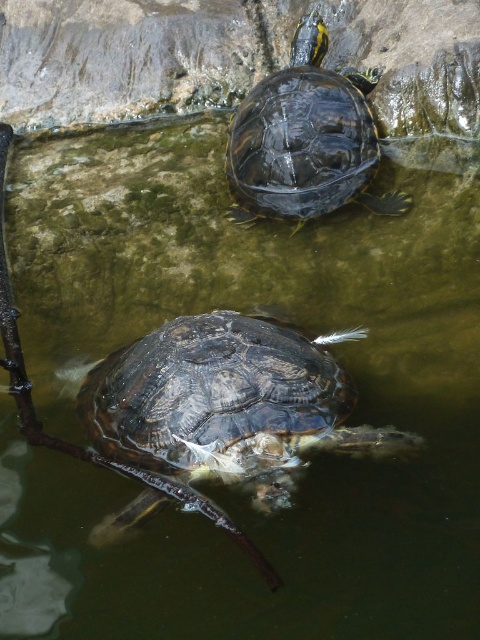
You are a wildlife photographer aiming to capture a closeup shot of both the shiny dark turtle at center and the shiny dark turtle at upper center. Given that your camera lens has a maximum focus range of 80 centimeters, can you photograph both turtles without moving your position?

The shiny dark turtle at center is 82.37 centimeters away from the shiny dark turtle at upper center. Since the distance between them exceeds the camera lens maximum focus range of 80 centimeters, you cannot photograph both turtles simultaneously without moving your position.

You are a photographer trying to capture the turtle in the foreground. You notice two points marked in the image, point 1 at coordinates point (176, 376) and point 2 at coordinates point (255, 177). Which point should you focus on to ensure the turtle is sharp in your photo?

You should focus on point (176, 376) because it is closer to the viewer than point (255, 177), and the turtle in the foreground is the main subject.

You are a wildlife photographer aiming to capture a closeup of both shiny dark turtle at center and shiny dark turtle at upper center in the image. Given that your camera lens can only focus on objects within a 30 cm width range, can you determine if both turtles can fit into the frame at the same time?

The shiny dark turtle at center has a larger width than the shiny dark turtle at upper center, but the exact width difference isn not provided. Without knowing the specific widths of both turtles, it is impossible to determine if their combined width falls within the 30 cm range required by the camera lens.